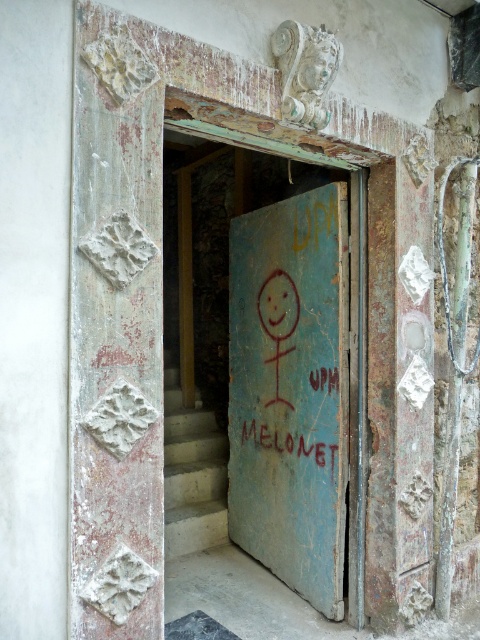
Is point (337, 552) farther from viewer compared to point (180, 420)?

That is False.

Who is lower down, blue painted wood door at center or concrete stairs at center?

concrete stairs at center

Where is `blue painted wood door at center`? Image resolution: width=480 pixels, height=640 pixels. blue painted wood door at center is located at coordinates [x=290, y=390].

The height and width of the screenshot is (640, 480). I want to click on blue painted wood door at center, so click(290, 390).

Does blue painted wood door at center lie in front of red painted text at center?

Yes, it is in front of red painted text at center.

Who is more forward, (x=344, y=612) or (x=335, y=454)?

Positioned in front is point (x=335, y=454).

Between point (311, 280) and point (240, 442), which one is positioned in front?

Positioned in front is point (311, 280).

You are a GUI agent. You are given a task and a screenshot of the screen. Output one action in this format:
    pyautogui.click(x=<x>, y=<y>)
    Task: Click on the blue painted wood door at center
    Image resolution: width=480 pixels, height=640 pixels.
    Given the screenshot: What is the action you would take?
    pyautogui.click(x=290, y=390)

Who is more forward, [169,461] or [250,436]?

Point [250,436] is in front.

Is point (183, 410) positioned behind point (295, 436)?

Yes, point (183, 410) is farther from viewer.

Find the location of a particular element. Image resolution: width=480 pixels, height=640 pixels. concrete stairs at center is located at coordinates (192, 474).

This screenshot has height=640, width=480. Identify the location of concrete stairs at center. (192, 474).